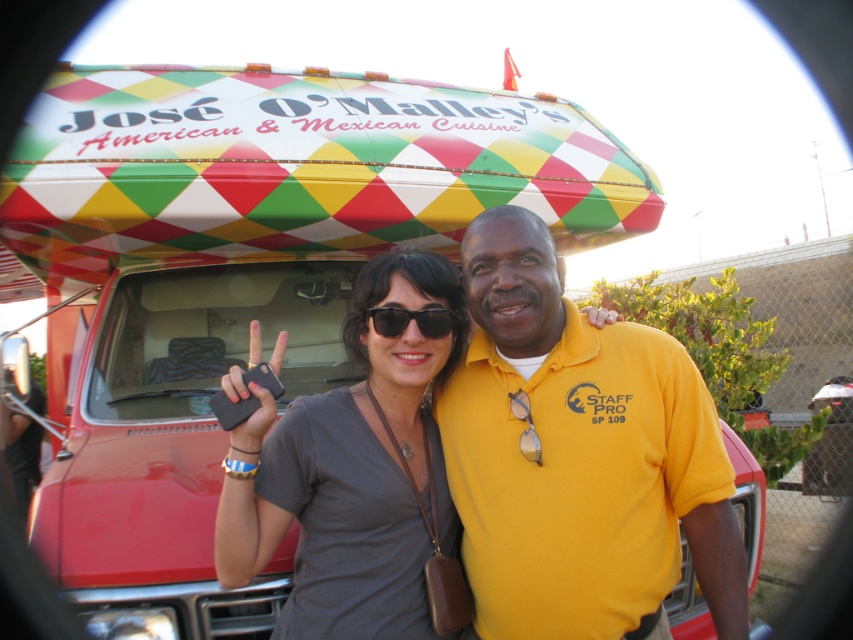
Question: Considering the relative positions of gray matte shirt at center and black plastic sunglasses at center in the image provided, where is gray matte shirt at center located with respect to black plastic sunglasses at center?

Choices:
 (A) below
 (B) above

Answer: (A)

Question: Estimate the real-world distances between objects in this image. Which object is farther from the gray matte shirt at center?

Choices:
 (A) yellow cotton polo shirt at center
 (B) black plastic sunglasses at center

Answer: (A)

Question: Which object is the farthest from the yellow cotton polo shirt at center?

Choices:
 (A) black plastic sunglasses at center
 (B) gray matte shirt at center

Answer: (A)

Question: Which point is closer to the camera?

Choices:
 (A) yellow cotton polo shirt at center
 (B) black plastic sunglasses at center

Answer: (A)

Question: Is gray matte shirt at center wider than black plastic sunglasses at center?

Choices:
 (A) no
 (B) yes

Answer: (B)

Question: Does yellow cotton polo shirt at center appear on the left side of gray matte shirt at center?

Choices:
 (A) yes
 (B) no

Answer: (B)